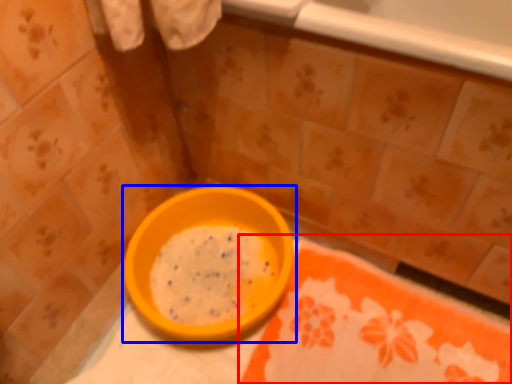
Question: Which of the following is the farthest to the observer, tablecloth (highlighted by a red box) or bowl (highlighted by a blue box)?

Choices:
 (A) tablecloth
 (B) bowl

Answer: (B)